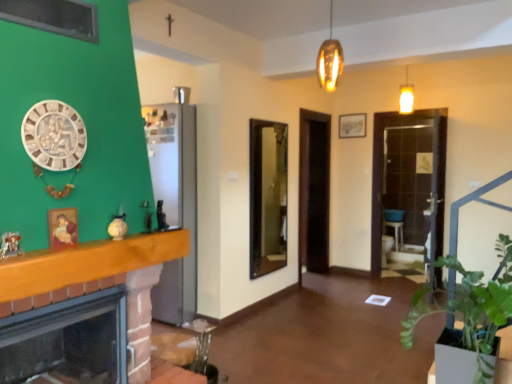
Question: Considering the positions of brick fireplace at left and matte wooden picture frame at left in the image, is brick fireplace at left bigger or smaller than matte wooden picture frame at left?

Choices:
 (A) big
 (B) small

Answer: (A)

Question: From a real-world perspective, is brick fireplace at left positioned above or below matte wooden picture frame at left?

Choices:
 (A) below
 (B) above

Answer: (A)

Question: Based on their relative distances, which object is farther from the brick fireplace at left?

Choices:
 (A) matte wooden picture frame at left
 (B) green leafy plant at lower right
 (C) wooden mantel at left

Answer: (B)

Question: Which is farther from the matte wooden picture frame at left?

Choices:
 (A) green leafy plant at lower right
 (B) brick fireplace at left
 (C) wooden mantel at left

Answer: (A)